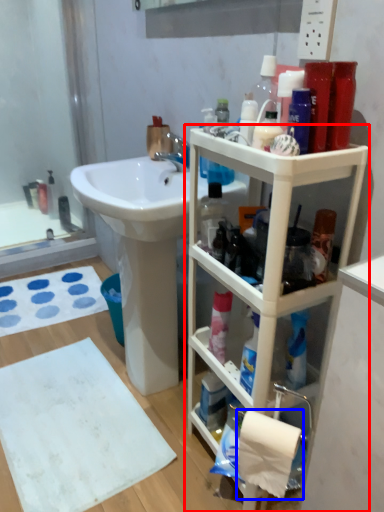
Question: Which of the following is the closest to the observer, bathroom cabinet (highlighted by a red box) or toilet paper (highlighted by a blue box)?

Choices:
 (A) bathroom cabinet
 (B) toilet paper

Answer: (A)